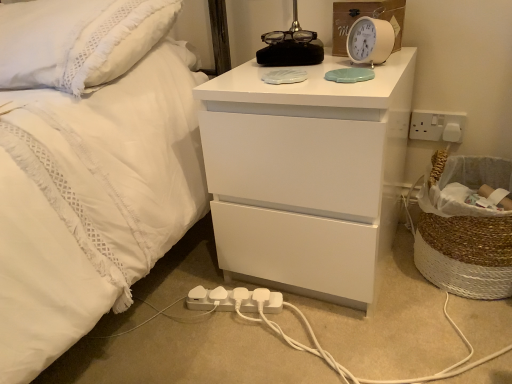
Question: Is the depth of white plastic extension cord at lower center greater than that of white glossy chest of drawers at upper center?

Choices:
 (A) yes
 (B) no

Answer: (A)

Question: Is white plastic extension cord at lower center oriented away from white glossy chest of drawers at upper center?

Choices:
 (A) no
 (B) yes

Answer: (B)

Question: Can you confirm if white plastic extension cord at lower center is thinner than white glossy chest of drawers at upper center?

Choices:
 (A) no
 (B) yes

Answer: (B)

Question: Is white plastic extension cord at lower center outside of white glossy chest of drawers at upper center?

Choices:
 (A) no
 (B) yes

Answer: (B)

Question: Can you confirm if white plastic extension cord at lower center is wider than white glossy chest of drawers at upper center?

Choices:
 (A) no
 (B) yes

Answer: (A)

Question: Choose the correct answer: Is white plastic alarm clock at upper right inside white textured pillow at upper left or outside it?

Choices:
 (A) outside
 (B) inside

Answer: (A)

Question: Would you say white plastic alarm clock at upper right is to the left or to the right of white textured pillow at upper left in the picture?

Choices:
 (A) left
 (B) right

Answer: (B)

Question: From a real-world perspective, is white plastic alarm clock at upper right above or below white textured pillow at upper left?

Choices:
 (A) above
 (B) below

Answer: (B)

Question: Based on their sizes in the image, would you say white plastic alarm clock at upper right is bigger or smaller than white textured pillow at upper left?

Choices:
 (A) small
 (B) big

Answer: (A)

Question: Based on their sizes in the image, would you say white textured pillow at upper left is bigger or smaller than white plastic alarm clock at upper right?

Choices:
 (A) big
 (B) small

Answer: (A)

Question: Considering the positions of white textured pillow at upper left and white plastic alarm clock at upper right in the image, is white textured pillow at upper left wider or thinner than white plastic alarm clock at upper right?

Choices:
 (A) wide
 (B) thin

Answer: (A)

Question: In the image, is white textured pillow at upper left positioned in front of or behind white plastic alarm clock at upper right?

Choices:
 (A) front
 (B) behind

Answer: (A)

Question: Would you say white textured pillow at upper left is inside or outside white plastic alarm clock at upper right?

Choices:
 (A) inside
 (B) outside

Answer: (B)

Question: Is white plastic alarm clock at upper right wider or thinner than braided straw laundry basket at right?

Choices:
 (A) thin
 (B) wide

Answer: (A)

Question: Is white plastic alarm clock at upper right to the left or to the right of braided straw laundry basket at right in the image?

Choices:
 (A) left
 (B) right

Answer: (A)